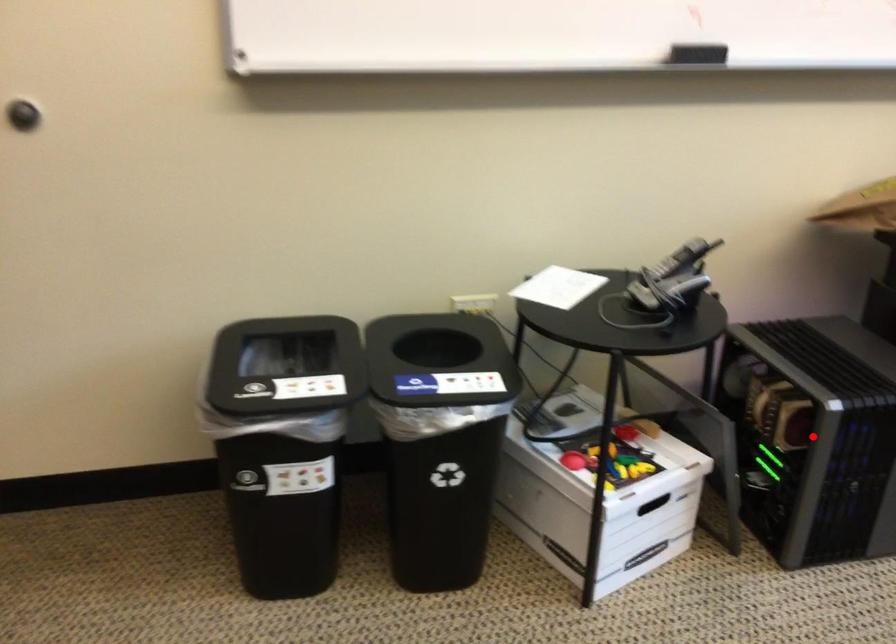
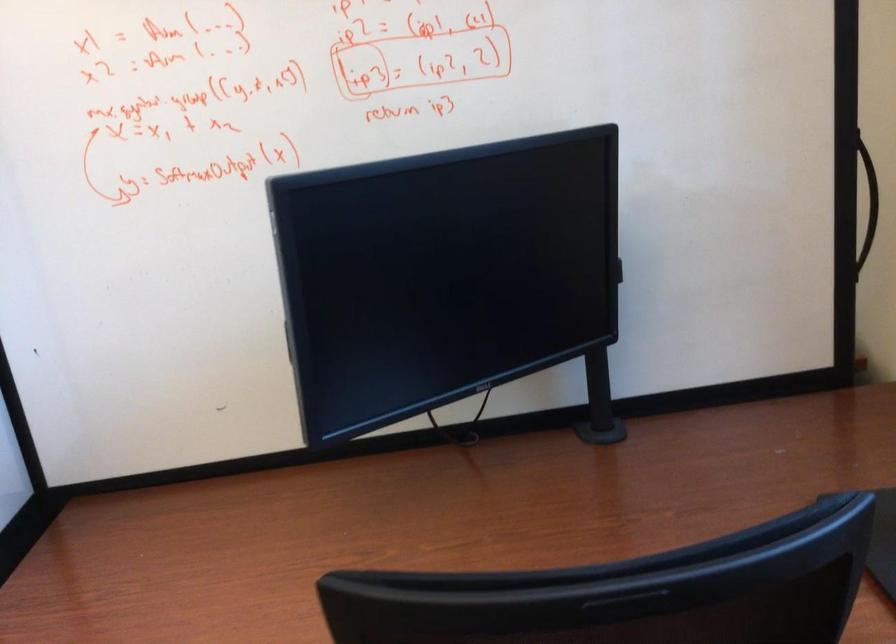
Question: I am providing you with two images of the same scene from different viewpoints. A red point is marked on the first image. Is the red point's position out of view in image 2?

Choices:
 (A) Yes
 (B) No

Answer: (A)